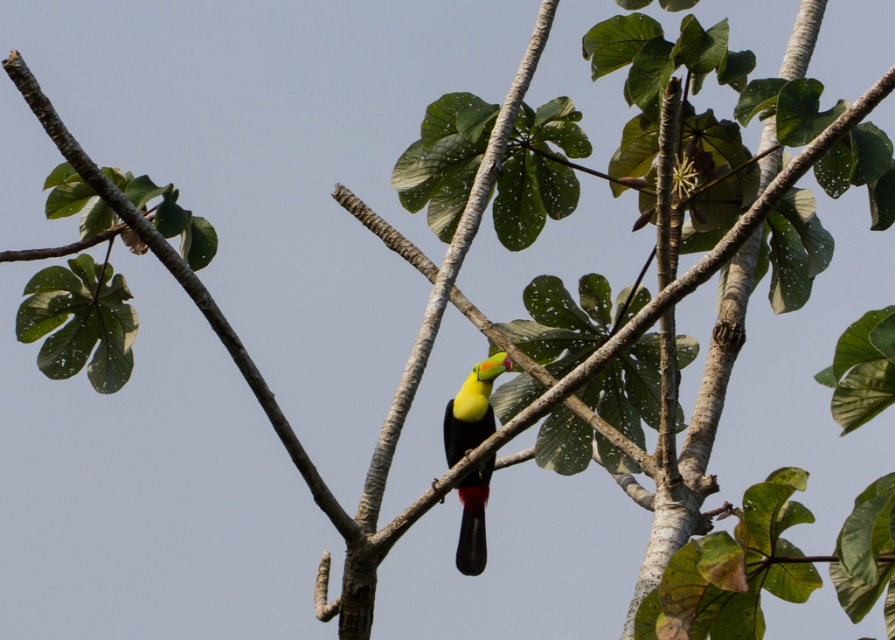
You are a birdwatcher trying to locate two specific points in the image. The first point is at coordinates point (131, 227) and the second is at point (476, 388). Which point is closer to the viewer?

Point (131, 227) is in front of point (476, 388), so it is closer to the viewer.

You are an ornithologist observing the scene. You notice the green matte leaf at upper left and the yellow matte parrot at center. Which object is positioned closer to your viewpoint?

The green matte leaf at upper left is closer to the viewer than the yellow matte parrot at center.

You are an ornithologist observing the scene. You notice the green matte leaf at upper left and the yellow matte parrot at center. Which object is bigger in size?

The green matte leaf at upper left is larger in size compared to the yellow matte parrot at center.